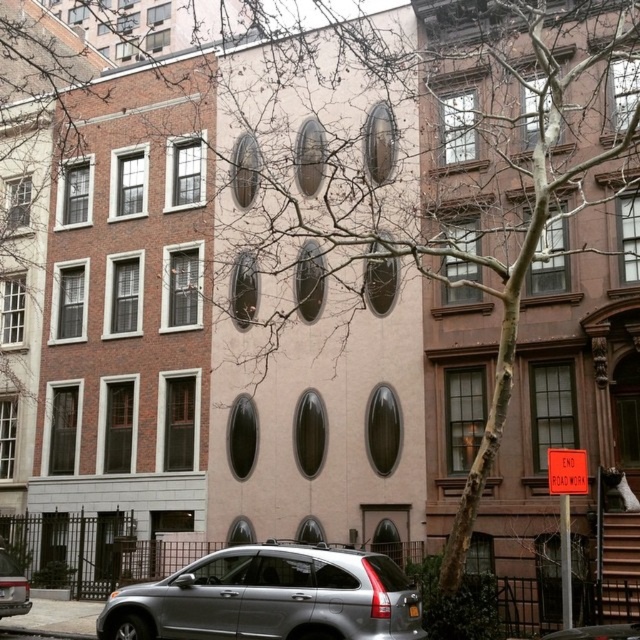
Question: Is satin silver suv at lower center to the left of silver metallic suv at lower left from the viewer's perspective?

Choices:
 (A) yes
 (B) no

Answer: (B)

Question: Among these objects, which one is nearest to the camera?

Choices:
 (A) satin silver suv at lower center
 (B) silver metallic suv at lower left

Answer: (A)

Question: Can you confirm if satin silver suv at lower center is bigger than silver metallic suv at lower left?

Choices:
 (A) yes
 (B) no

Answer: (A)

Question: Considering the relative positions of satin silver suv at lower center and silver metallic suv at lower left in the image provided, where is satin silver suv at lower center located with respect to silver metallic suv at lower left?

Choices:
 (A) below
 (B) above

Answer: (B)